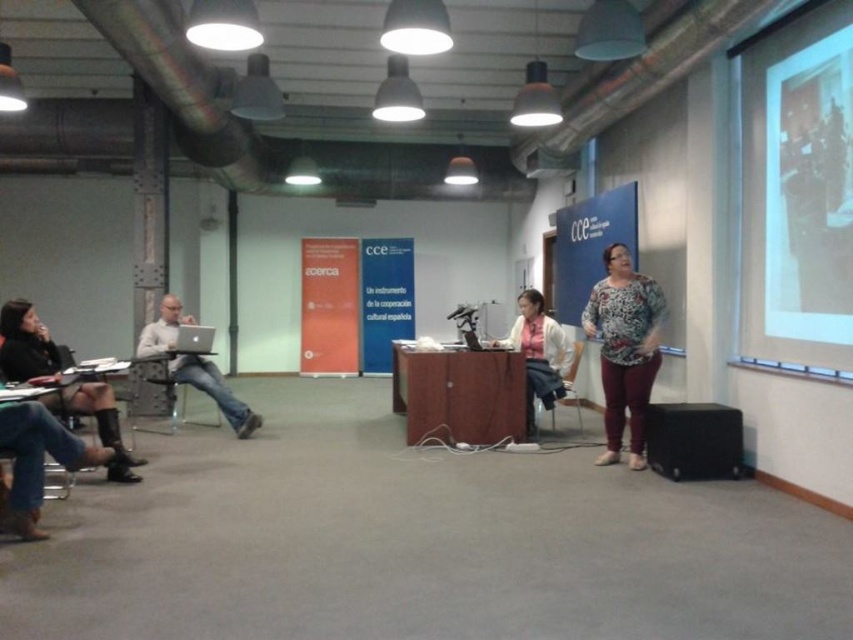
Question: From the image, what is the correct spatial relationship of white matte projection screen at upper right in relation to white fabric shirt at center?

Choices:
 (A) above
 (B) below

Answer: (A)

Question: Which of the following is the farthest from the observer?

Choices:
 (A) (180, 422)
 (B) (549, 410)
 (C) (624, 324)
 (D) (28, 369)

Answer: (A)

Question: Is white fabric shirt at center wider than light gray sweater at left?

Choices:
 (A) no
 (B) yes

Answer: (A)

Question: Among these objects, which one is nearest to the camera?

Choices:
 (A) metallic silver chair at left
 (B) light gray sweater at left
 (C) black matte speaker at lower right
 (D) floral print blouse at center

Answer: (C)

Question: Considering the relative positions of black leather boots at lower left and metallic silver chair at left in the image provided, where is black leather boots at lower left located with respect to metallic silver chair at left?

Choices:
 (A) above
 (B) below

Answer: (A)

Question: Based on their relative distances, which object is nearer to the white fabric shirt at center?

Choices:
 (A) metallic silver chair at left
 (B) wooden chair at center

Answer: (B)